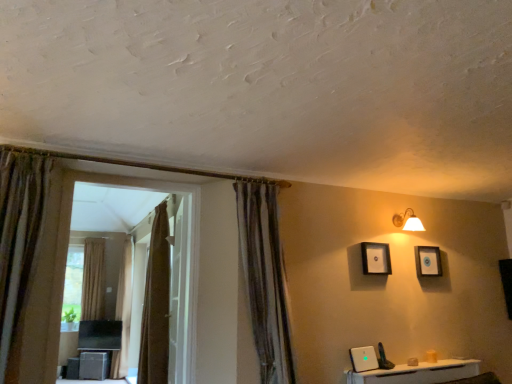
Question: From the image's perspective, relative to brown textured curtain at left, marked as the third curtain in a front-to-back arrangement, is white glossy door at center above or below?

Choices:
 (A) above
 (B) below

Answer: (A)

Question: Is white glossy door at center wider or thinner than brown textured curtain at left, which is the 2th curtain from back to front?

Choices:
 (A) wide
 (B) thin

Answer: (B)

Question: Considering the real-world distances, which object is farthest from the white glossy router at lower right?

Choices:
 (A) brown fabric bay window at left
 (B) white glossy door at center
 (C) brown textured curtain at left, which ranks as the 3th curtain in right-to-left order
 (D) brown textured curtain at center, the 4th curtain viewed from the back
 (E) matte black picture frame at upper center, the second picture frame viewed from the back

Answer: (C)

Question: Estimate the real-world distances between objects in this image. Which object is farther from the brown fabric curtain at center, which appears as the third curtain when viewed from the left?

Choices:
 (A) matte black picture frame at upper center, the 1th picture frame when ordered from front to back
 (B) white glossy door at center
 (C) brown textured curtain at left, which is the 2th curtain from back to front
 (D) brown textured curtain at center, the 4th curtain viewed from the back
 (E) brown fabric bay window at left

Answer: (A)